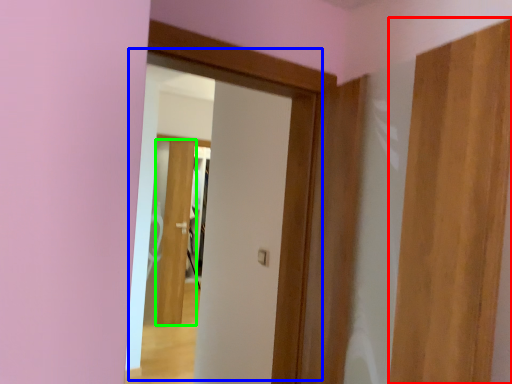
Question: Based on their relative distances, which object is farther from door (highlighted by a red box)? Choose from door (highlighted by a blue box) and door (highlighted by a green box).

Choices:
 (A) door
 (B) door

Answer: (B)